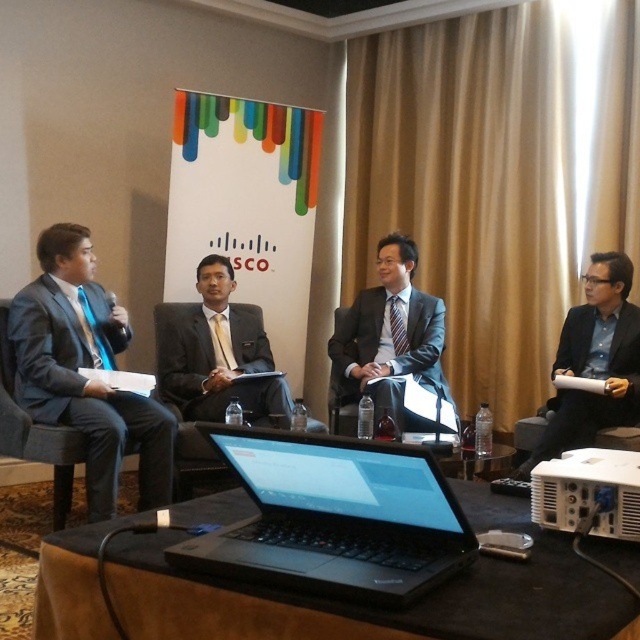
You are an event organizer arranging seating for the panel discussion. The satin black suit at center and the blue fabric suit at right need to be seated in order of their height. Which one should be seated first if taller individuals are to be seated first?

The blue fabric suit at right should be seated first because it is taller than the satin black suit at center, as stated in the description.